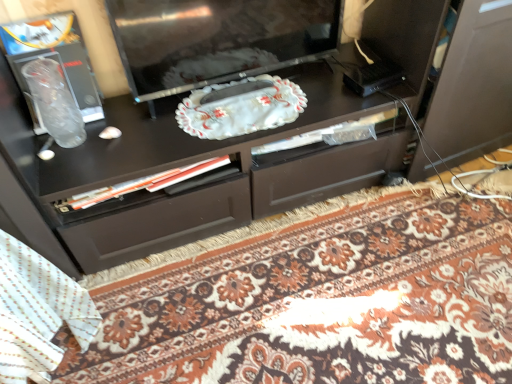
Question: Can you confirm if floral carpet at center is bigger than glossy black television at center?

Choices:
 (A) yes
 (B) no

Answer: (A)

Question: Considering the relative positions of floral carpet at center and glossy black television at center in the image provided, is floral carpet at center to the right of glossy black television at center from the viewer's perspective?

Choices:
 (A) no
 (B) yes

Answer: (B)

Question: Does floral carpet at center contain glossy black television at center?

Choices:
 (A) yes
 (B) no

Answer: (B)

Question: Is floral carpet at center taller than glossy black television at center?

Choices:
 (A) yes
 (B) no

Answer: (B)

Question: From the image's perspective, would you say floral carpet at center is shown under glossy black television at center?

Choices:
 (A) no
 (B) yes

Answer: (B)

Question: Considering the positions of floral carpet at center and white textured blanket at lower left in the image, is floral carpet at center wider or thinner than white textured blanket at lower left?

Choices:
 (A) wide
 (B) thin

Answer: (A)

Question: Relative to white textured blanket at lower left, is floral carpet at center in front or behind?

Choices:
 (A) behind
 (B) front

Answer: (A)

Question: From the image's perspective, is floral carpet at center above or below white textured blanket at lower left?

Choices:
 (A) below
 (B) above

Answer: (A)

Question: Do you think floral carpet at center is within white textured blanket at lower left, or outside of it?

Choices:
 (A) inside
 (B) outside

Answer: (B)

Question: Considering the positions of point (184, 51) and point (42, 269), is point (184, 51) closer or farther from the camera than point (42, 269)?

Choices:
 (A) farther
 (B) closer

Answer: (A)

Question: Visually, is glossy black television at center positioned to the left or to the right of white textured blanket at lower left?

Choices:
 (A) right
 (B) left

Answer: (A)

Question: Is glossy black television at center taller or shorter than white textured blanket at lower left?

Choices:
 (A) short
 (B) tall

Answer: (A)

Question: Relative to white textured blanket at lower left, is glossy black television at center in front or behind?

Choices:
 (A) behind
 (B) front

Answer: (A)

Question: Based on their positions, is white textured blanket at lower left located to the left or right of glossy black television at center?

Choices:
 (A) right
 (B) left

Answer: (B)

Question: From a real-world perspective, is white textured blanket at lower left positioned above or below glossy black television at center?

Choices:
 (A) below
 (B) above

Answer: (A)